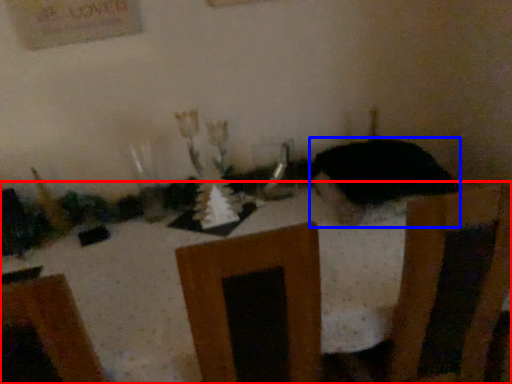
Question: Which object is closer to the camera taking this photo, furniture (highlighted by a red box) or animal (highlighted by a blue box)?

Choices:
 (A) furniture
 (B) animal

Answer: (A)